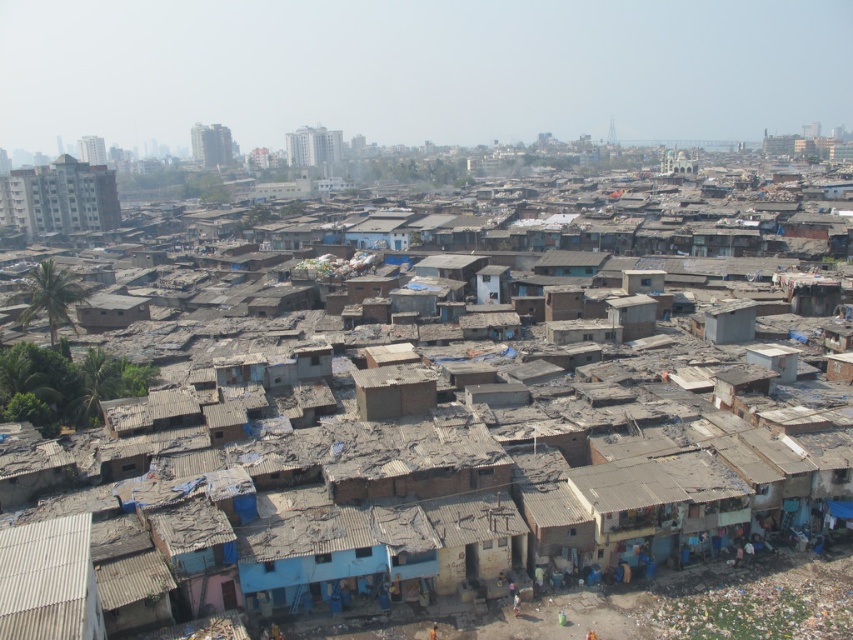
Is gray corrugated metal hut at lower left positioned behind brown mud brick hut at center?

No, it is in front of brown mud brick hut at center.

Between gray corrugated metal hut at lower left and brown mud brick hut at center, which one is positioned lower?

gray corrugated metal hut at lower left is lower down.

Where is `gray corrugated metal hut at lower left`? The width and height of the screenshot is (853, 640). gray corrugated metal hut at lower left is located at coordinates (48, 580).

Does gray corrugated metal hut at lower left have a smaller size compared to matte concrete building at upper left?

Correct, gray corrugated metal hut at lower left occupies less space than matte concrete building at upper left.

Who is positioned more to the left, gray corrugated metal hut at lower left or matte concrete building at upper left?

Positioned to the left is matte concrete building at upper left.

Image resolution: width=853 pixels, height=640 pixels. I want to click on gray corrugated metal hut at lower left, so [48, 580].

I want to click on gray corrugated metal hut at lower left, so click(48, 580).

Does matte concrete building at upper left have a greater height compared to brown mud brick hut at center?

Indeed, matte concrete building at upper left has a greater height compared to brown mud brick hut at center.

Is the position of matte concrete building at upper left more distant than that of brown mud brick hut at center?

Yes, it is.

Identify the location of matte concrete building at upper left. (59, 196).